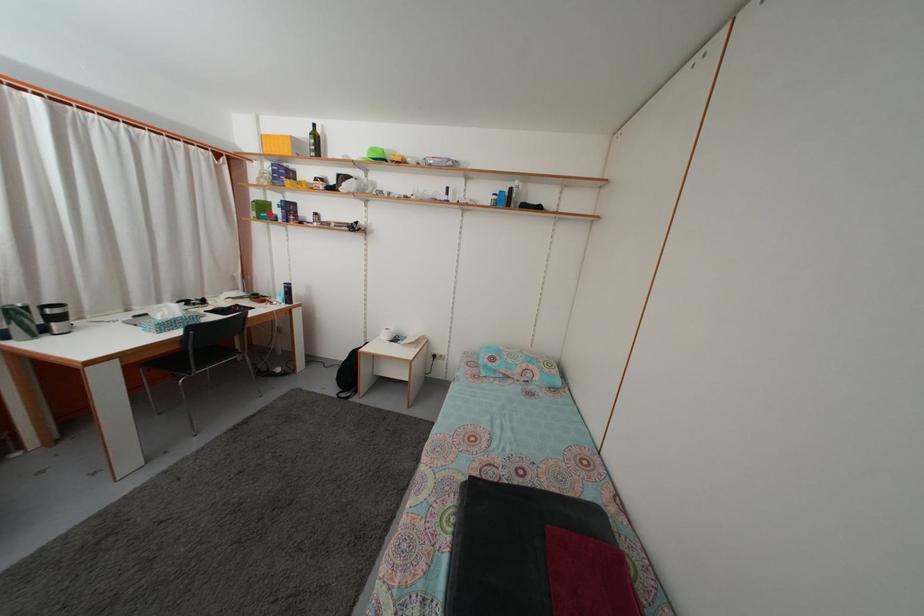
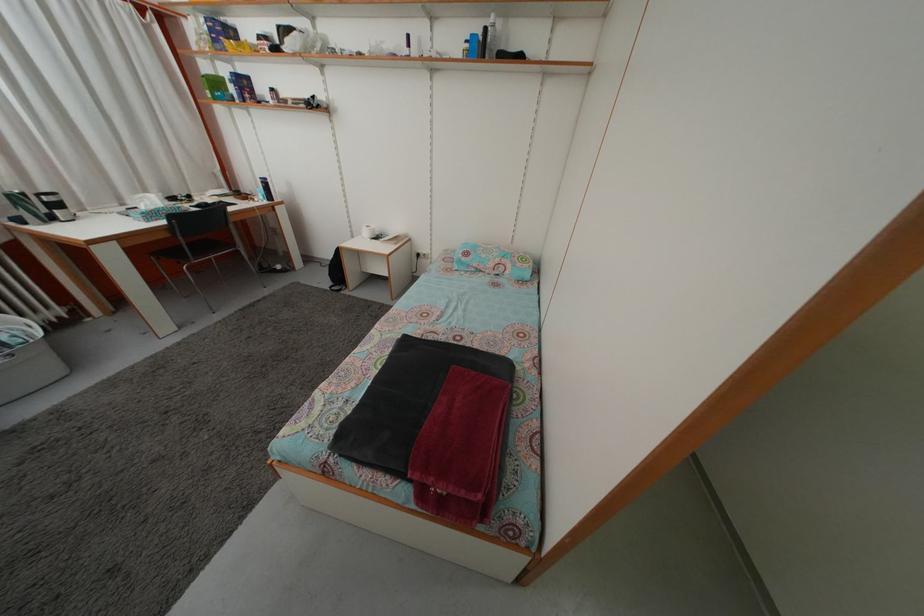
In the second image, find the point that corresponds to the highlighted location in the first image.

(223, 91)